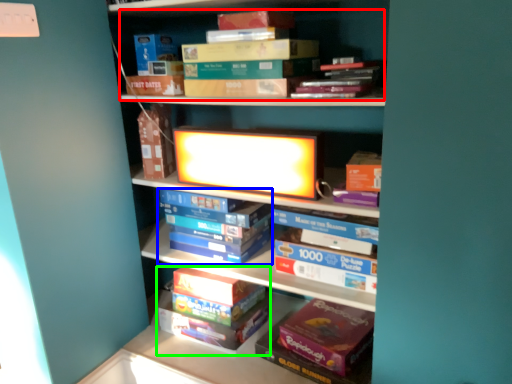
Question: Considering the real-world distances, which object is closest to book (highlighted by a red box)? book (highlighted by a blue box) or book (highlighted by a green box).

Choices:
 (A) book
 (B) book

Answer: (A)